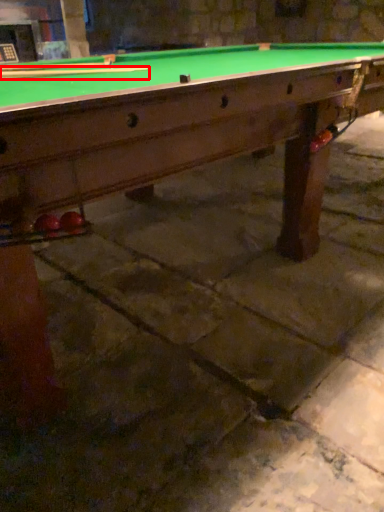
Question: Where is cue (annotated by the red box) located in relation to cue in the image?

Choices:
 (A) right
 (B) left

Answer: (A)